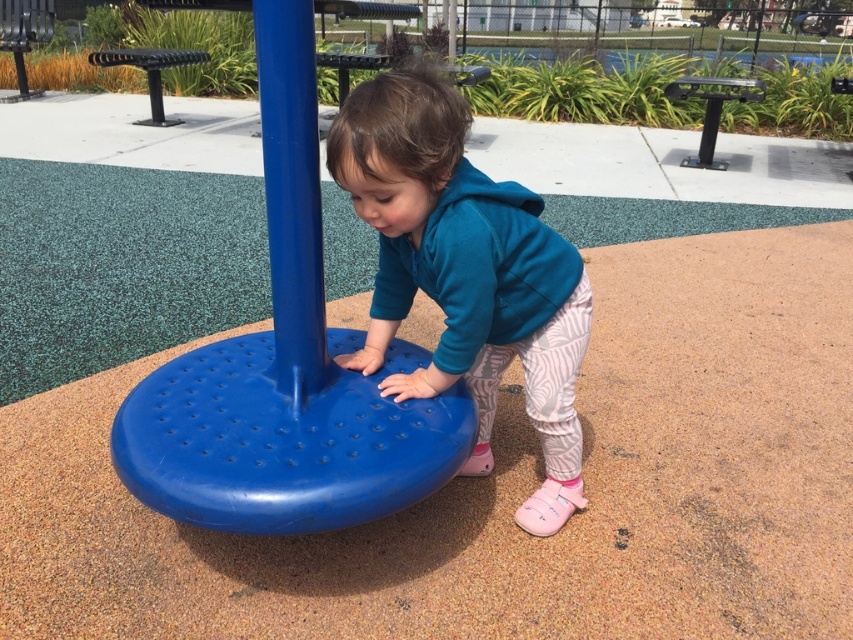
Between point (287, 349) and point (352, 141), which one is positioned in front?

Positioned in front is point (352, 141).

Does point (340, 502) lie in front of point (415, 170)?

Yes, point (340, 502) is closer to viewer.

This screenshot has width=853, height=640. I want to click on blue plastic platform at center, so click(x=285, y=364).

In the scene shown: Measure the distance between blue plastic platform at center and blue plastic pole at center.

The distance of blue plastic platform at center from blue plastic pole at center is 4.63 inches.

Which is more to the left, blue plastic platform at center or blue plastic pole at center?

Positioned to the left is blue plastic pole at center.

Is point (281, 428) positioned after point (283, 60)?

Yes, point (281, 428) is farther from viewer.

Find the location of a particular element. This screenshot has width=853, height=640. blue plastic platform at center is located at coordinates (285, 364).

Is teal fleece jacket at center above blue plastic pole at center?

No.

In the scene shown: Between teal fleece jacket at center and blue plastic pole at center, which one is positioned higher?

blue plastic pole at center

Is point (408, 387) positioned in front of point (276, 86)?

That is False.

Where is `teal fleece jacket at center`? This screenshot has width=853, height=640. teal fleece jacket at center is located at coordinates (465, 273).